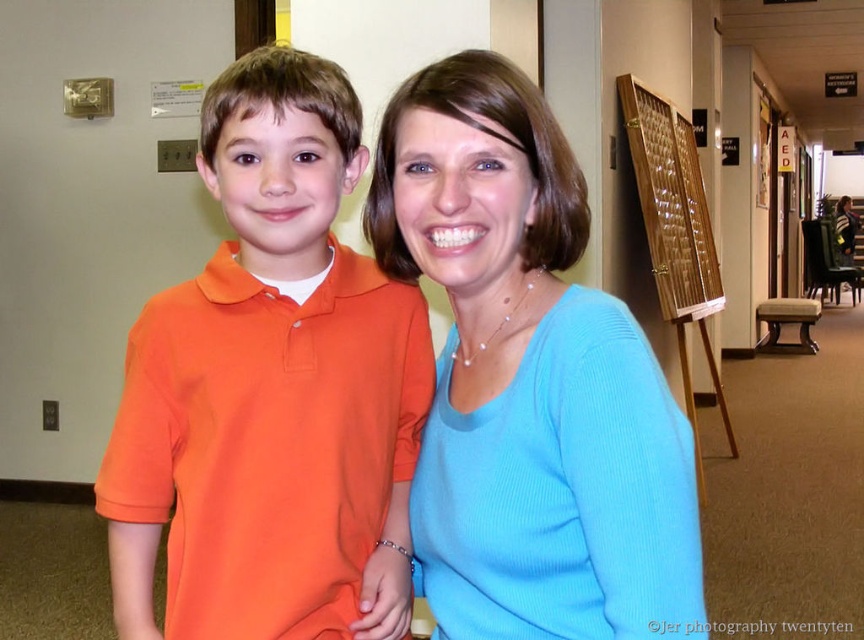
Between matte orange shirt at left and wooden textured board at right, which one has more height?

With more height is wooden textured board at right.

Who is lower down, matte orange shirt at left or wooden textured board at right?

matte orange shirt at left

Is point (347, 328) closer to camera compared to point (681, 228)?

That is True.

Identify the location of matte orange shirt at left. (271, 390).

Is blue knit sweater at center thinner than wooden textured board at right?

Indeed, blue knit sweater at center has a lesser width compared to wooden textured board at right.

Is blue knit sweater at center below wooden textured board at right?

Yes, blue knit sweater at center is below wooden textured board at right.

Measure the distance between point (556, 204) and camera.

Point (556, 204) is 85.97 centimeters from camera.

I want to click on blue knit sweater at center, so click(529, 381).

Which is below, matte orange shirt at left or blue knit sweater at center?

blue knit sweater at center is lower down.

Does matte orange shirt at left appear under blue knit sweater at center?

No, matte orange shirt at left is not below blue knit sweater at center.

Find the location of `matte orange shirt at left`. matte orange shirt at left is located at coordinates (271, 390).

Locate an element on the screen. This screenshot has width=864, height=640. matte orange shirt at left is located at coordinates (271, 390).